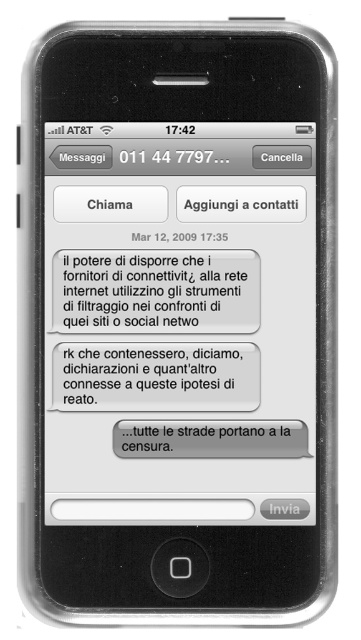
You are holding an iPhone and want to read the text message displayed on the screen. Considering the distance between you and the white paper text message at center, can you comfortably read the message without needing to move closer or farther away?

The white paper text message at center and viewer are 34.41 inches apart from each other. At this distance, it is likely comfortable to read the message without needing to adjust your position, as typical reading distances for smartphones are around 12 to 16 inches, but individual comfort varies.

In the scene shown: You are looking at the smartphone screen and want to read the messages from left to right. Which message should you read first, the white paper text message at center or the gray matte text message at center?

The white paper text message at center is to the left of the gray matte text message at center, so you should read the white paper text message at center first when reading from left to right.